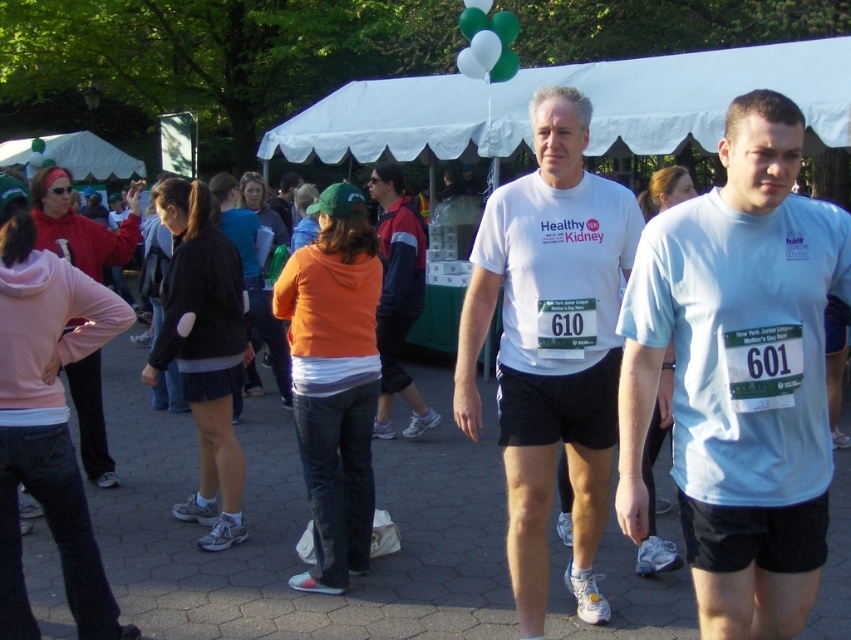
I want to click on white matte t-shirt at center, so click(x=550, y=346).

Between white matte t-shirt at center and dark gray fleece jacket at center, which one appears on the right side from the viewer's perspective?

Positioned to the right is white matte t-shirt at center.

Locate an element on the screen. The image size is (851, 640). white matte t-shirt at center is located at coordinates (550, 346).

Which is in front, point (484, 284) or point (338, 424)?

Positioned in front is point (484, 284).

Image resolution: width=851 pixels, height=640 pixels. What are the coordinates of `white matte t-shirt at center` in the screenshot? It's located at (550, 346).

The image size is (851, 640). In order to click on white matte t-shirt at center in this screenshot , I will do `click(550, 346)`.

Which of these two, white matte t-shirt at center or white fabric canopy at upper center, stands taller?

white matte t-shirt at center

Locate an element on the screen. The image size is (851, 640). white matte t-shirt at center is located at coordinates (550, 346).

This screenshot has height=640, width=851. What do you see at coordinates (550, 346) in the screenshot?
I see `white matte t-shirt at center` at bounding box center [550, 346].

Locate an element on the screen. The width and height of the screenshot is (851, 640). white matte t-shirt at center is located at coordinates (550, 346).